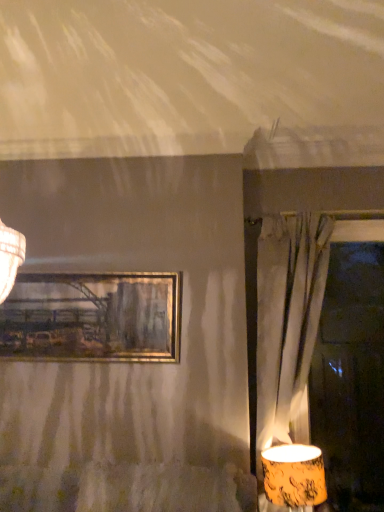
Question: Considering the relative sizes of matte gray curtain at right and gold metallic picture frame at upper center in the image provided, is matte gray curtain at right bigger than gold metallic picture frame at upper center?

Choices:
 (A) no
 (B) yes

Answer: (B)

Question: Can you confirm if matte gray curtain at right is smaller than gold metallic picture frame at upper center?

Choices:
 (A) yes
 (B) no

Answer: (B)

Question: From the image's perspective, is matte gray curtain at right on top of gold metallic picture frame at upper center?

Choices:
 (A) yes
 (B) no

Answer: (B)

Question: From a real-world perspective, is matte gray curtain at right located higher than gold metallic picture frame at upper center?

Choices:
 (A) no
 (B) yes

Answer: (A)

Question: Is the depth of matte gray curtain at right less than that of gold metallic picture frame at upper center?

Choices:
 (A) yes
 (B) no

Answer: (A)

Question: From the image's perspective, is matte orange lampshade at lower right above or below gold metallic picture frame at upper center?

Choices:
 (A) below
 (B) above

Answer: (A)

Question: Is matte orange lampshade at lower right in front of or behind gold metallic picture frame at upper center in the image?

Choices:
 (A) front
 (B) behind

Answer: (A)

Question: Is point (304, 467) closer or farther from the camera than point (79, 294)?

Choices:
 (A) farther
 (B) closer

Answer: (B)

Question: In terms of height, does matte orange lampshade at lower right look taller or shorter compared to gold metallic picture frame at upper center?

Choices:
 (A) short
 (B) tall

Answer: (A)

Question: Is matte gray curtain at right bigger or smaller than gold metallic picture frame at upper center?

Choices:
 (A) small
 (B) big

Answer: (B)

Question: Is matte gray curtain at right situated inside gold metallic picture frame at upper center or outside?

Choices:
 (A) outside
 (B) inside

Answer: (A)

Question: Looking at their shapes, would you say matte gray curtain at right is wider or thinner than gold metallic picture frame at upper center?

Choices:
 (A) wide
 (B) thin

Answer: (A)

Question: From a real-world perspective, is matte gray curtain at right positioned above or below gold metallic picture frame at upper center?

Choices:
 (A) above
 (B) below

Answer: (B)

Question: Do you think matte orange lampshade at lower right is within matte gray curtain at right, or outside of it?

Choices:
 (A) inside
 (B) outside

Answer: (A)

Question: From a real-world perspective, is matte orange lampshade at lower right positioned above or below matte gray curtain at right?

Choices:
 (A) below
 (B) above

Answer: (A)